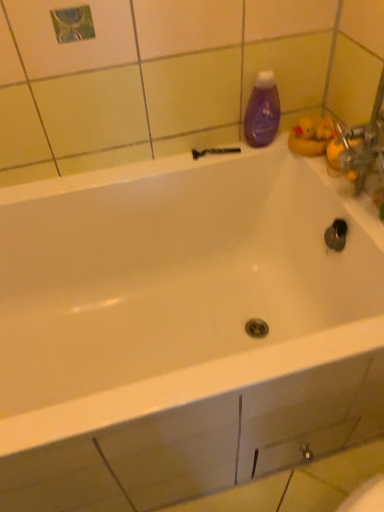
The image size is (384, 512). Find the location of `vacant space to the right of black plastic shower at upper center`. vacant space to the right of black plastic shower at upper center is located at coordinates (269, 148).